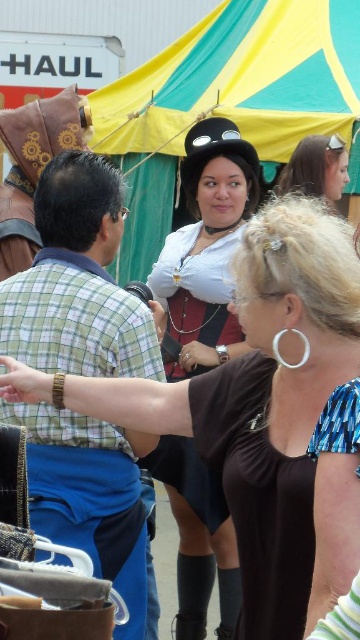
Which is above, green plaid shirt at left or matte black hat at upper center?

matte black hat at upper center is above.

Between green plaid shirt at left and matte black hat at upper center, which one appears on the right side from the viewer's perspective?

Positioned to the right is matte black hat at upper center.

What do you see at coordinates (78, 280) in the screenshot? This screenshot has height=640, width=360. I see `green plaid shirt at left` at bounding box center [78, 280].

This screenshot has height=640, width=360. Identify the location of green plaid shirt at left. (78, 280).

Does point (284, 324) come behind point (335, 180)?

No, it is in front of (335, 180).

Between point (316, 406) and point (294, 176), which one is positioned behind?

The point (294, 176) is behind.

You are a GUI agent. You are given a task and a screenshot of the screen. Output one action in this format:
    pyautogui.click(x=<x>, y=<y>)
    Task: Click on the matte white blouse at center
    This screenshot has width=360, height=640.
    Given the screenshot: What is the action you would take?
    pyautogui.click(x=266, y=413)

Does matte white blouse at center have a lesser height compared to green plaid shirt at left?

In fact, matte white blouse at center may be taller than green plaid shirt at left.

At what (x,y) coordinates should I click in order to perform the action: click on matte white blouse at center. Please return your answer as a coordinate pair (x, y). Looking at the image, I should click on (266, 413).

Describe the element at coordinates (266, 413) in the screenshot. I see `matte white blouse at center` at that location.

Identify the location of matte white blouse at center. The width and height of the screenshot is (360, 640). (266, 413).